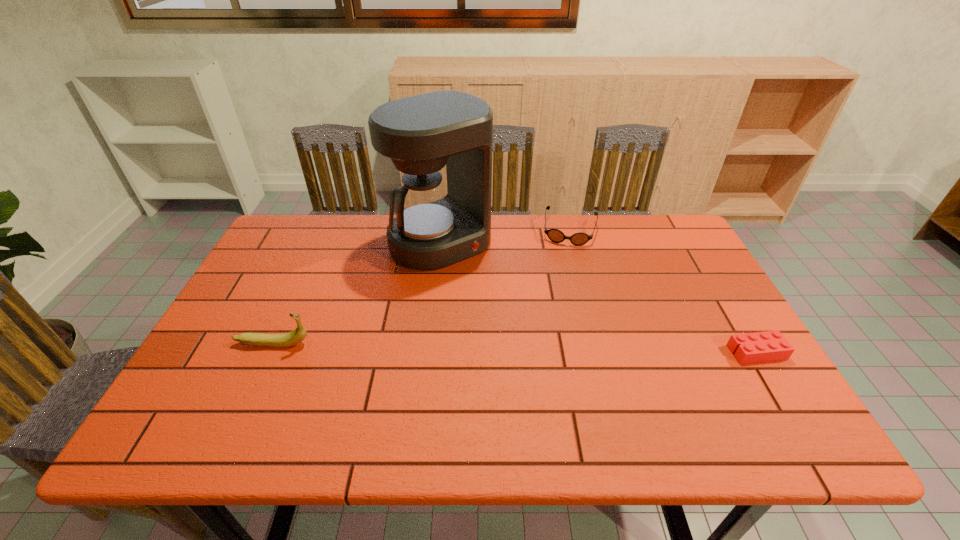
In the image, there is a desktop. Identify the location of free space at the far edge. This screenshot has height=540, width=960. (494, 214).

Where is `free region at the near edge`? The height and width of the screenshot is (540, 960). free region at the near edge is located at coordinates 368,396.

In the image, there is a desktop. Where is `vacant space at the left edge`? This screenshot has width=960, height=540. vacant space at the left edge is located at coordinates (250, 294).

Identify the location of vacant space at the right edge of the desktop. (699, 294).

Locate an element on the screen. This screenshot has height=540, width=960. vacant area at the far right corner of the desktop is located at coordinates (646, 235).

Where is `empty space that is in between the second object from left to right and the leftmost object`? The height and width of the screenshot is (540, 960). empty space that is in between the second object from left to right and the leftmost object is located at coordinates (357, 293).

You are a GUI agent. You are given a task and a screenshot of the screen. Output one action in this format:
    pyautogui.click(x=<x>, y=<y>)
    Task: Click on the free space between the shortest object and the third object from right to left
    
    Given the screenshot: What is the action you would take?
    pyautogui.click(x=599, y=297)

Find the location of `vacant space that is in between the third tallest object and the banana`. vacant space that is in between the third tallest object and the banana is located at coordinates (421, 287).

This screenshot has height=540, width=960. I want to click on free area in between the third tallest object and the third shortest object, so click(x=421, y=287).

What are the coordinates of `vacant point located between the sunglasses and the shortest object` in the screenshot? It's located at (662, 291).